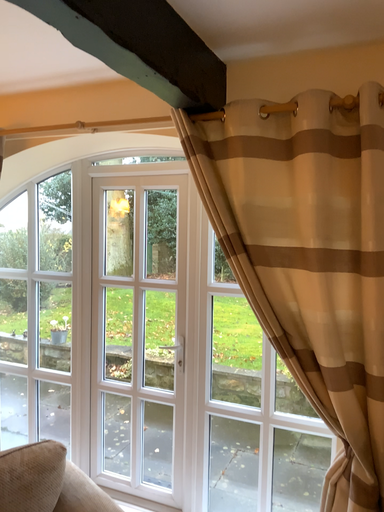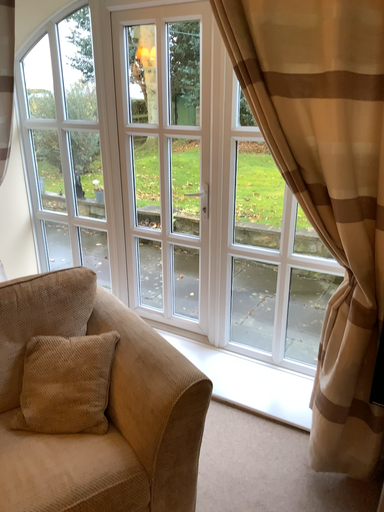
Question: Which way did the camera rotate in the video?

Choices:
 (A) rotated upward
 (B) rotated downward

Answer: (B)